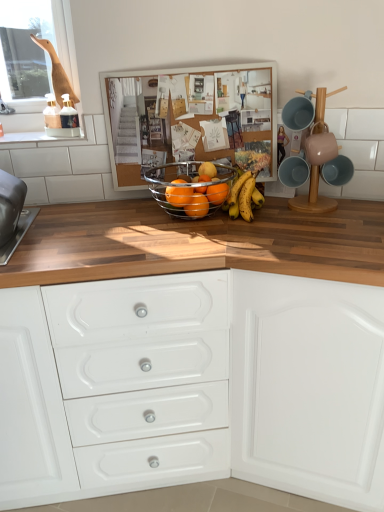
You are a GUI agent. You are given a task and a screenshot of the screen. Output one action in this format:
    pyautogui.click(x=<x>, y=<y>)
    Task: Click on the vacant region to the left of metallic wire basket at center
    The image size is (384, 512).
    Given the screenshot: What is the action you would take?
    pyautogui.click(x=108, y=221)